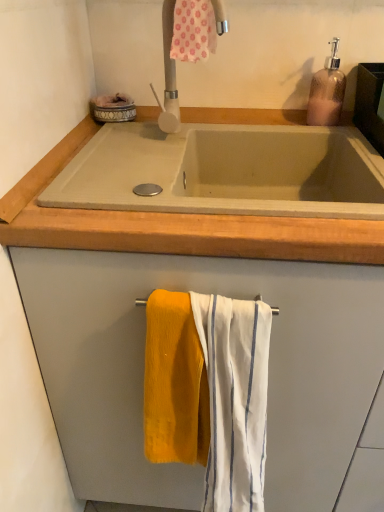
Where is `free space in front of white matte tap at upper center`? Image resolution: width=384 pixels, height=512 pixels. free space in front of white matte tap at upper center is located at coordinates (139, 165).